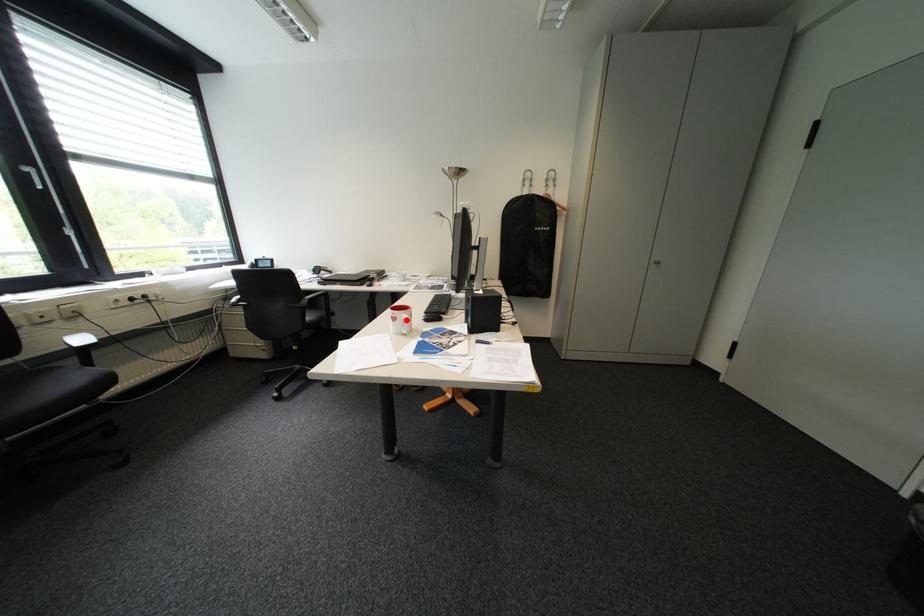
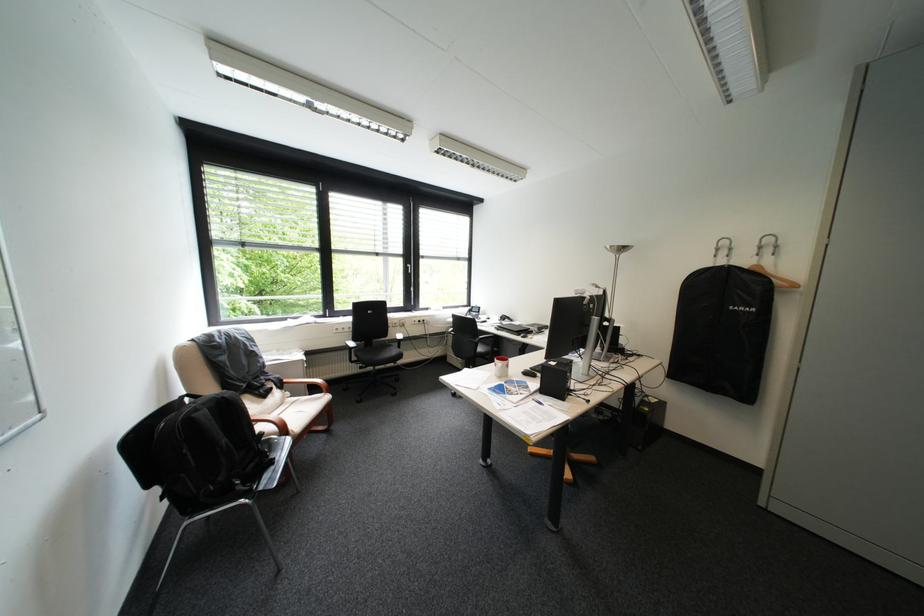
The point at the highlighted location is marked in the first image. Where is the corresponding point in the second image?

(507, 365)